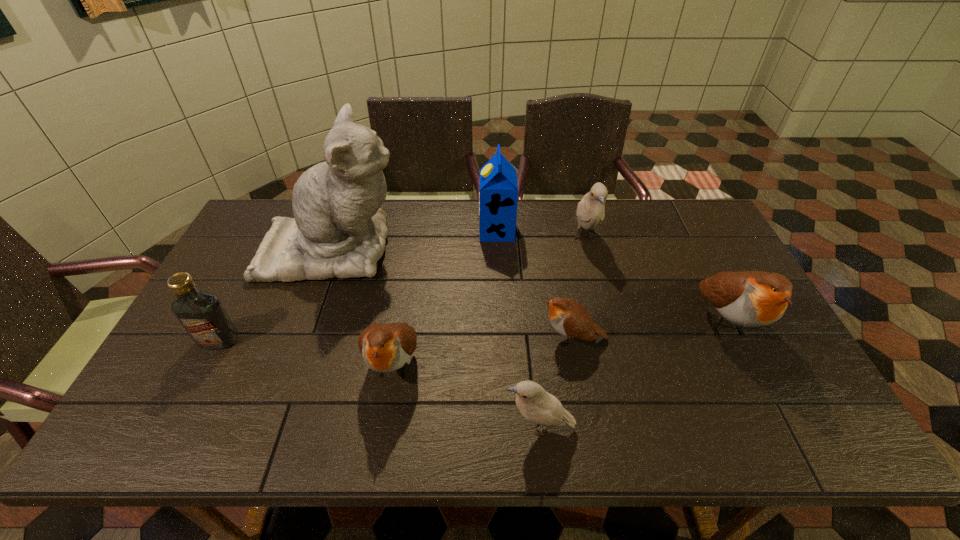
At what (x,y) coordinates should I click in order to perform the action: click on free space located 0.230m at the beak of the nearest object. Please return your answer as a coordinate pair (x, y). Looking at the image, I should click on (401, 428).

Where is `vacant space situated at the beak of the nearest object`? The width and height of the screenshot is (960, 540). vacant space situated at the beak of the nearest object is located at coordinates [437, 428].

What are the coordinates of `vacant space located at the beak of the nearest object` in the screenshot? It's located at (433, 428).

The width and height of the screenshot is (960, 540). What are the coordinates of `vacant space located 0.170m at the face of the shortest object` in the screenshot? It's located at (475, 338).

This screenshot has width=960, height=540. I want to click on free space located at the face of the shortest object, so click(x=452, y=338).

Where is `vacant position located 0.080m at the face of the shortest object`? Image resolution: width=960 pixels, height=540 pixels. vacant position located 0.080m at the face of the shortest object is located at coordinates [509, 338].

In order to click on cat that is at the far edge in this screenshot , I will do `click(339, 230)`.

At what (x,y) coordinates should I click in order to perform the action: click on carton present at the far edge. Please return your answer as a coordinate pair (x, y). This screenshot has height=540, width=960. Looking at the image, I should click on (498, 197).

Find the location of a particular element. bird that is at the far edge is located at coordinates (590, 210).

This screenshot has height=540, width=960. I want to click on object at the near edge, so click(535, 404).